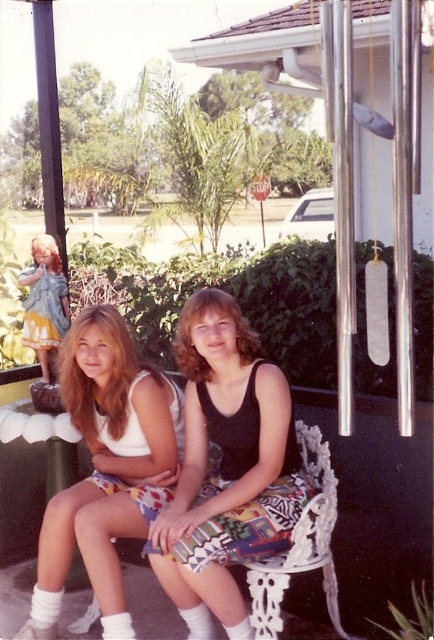
Can you confirm if black matte tank top at center is shorter than matte yellow dress at left?

No, black matte tank top at center is not shorter than matte yellow dress at left.

Does point (206, 346) lie behind point (45, 310)?

No, it is in front of (45, 310).

I want to click on black matte tank top at center, so click(226, 467).

Can you confirm if white fabric tank top at left is wider than matte yellow dress at left?

Correct, the width of white fabric tank top at left exceeds that of matte yellow dress at left.

Is point (164, 440) closer to camera compared to point (42, 268)?

That is True.

Image resolution: width=434 pixels, height=640 pixels. I want to click on white fabric tank top at left, so click(x=107, y=467).

Between point (184, 529) and point (125, 392), which one is positioned behind?

Point (125, 392)

Can you confirm if black matte tank top at center is wider than white fabric tank top at left?

Incorrect, black matte tank top at center's width does not surpass white fabric tank top at left's.

The image size is (434, 640). Describe the element at coordinates (226, 467) in the screenshot. I see `black matte tank top at center` at that location.

Locate an element on the screen. The image size is (434, 640). black matte tank top at center is located at coordinates (226, 467).